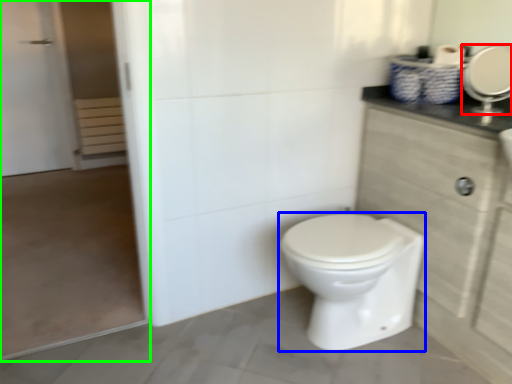
Question: Which object is positioned closest to mirror (highlighted by a red box)? Select from bidet (highlighted by a blue box) and screen door (highlighted by a green box).

Choices:
 (A) bidet
 (B) screen door

Answer: (A)